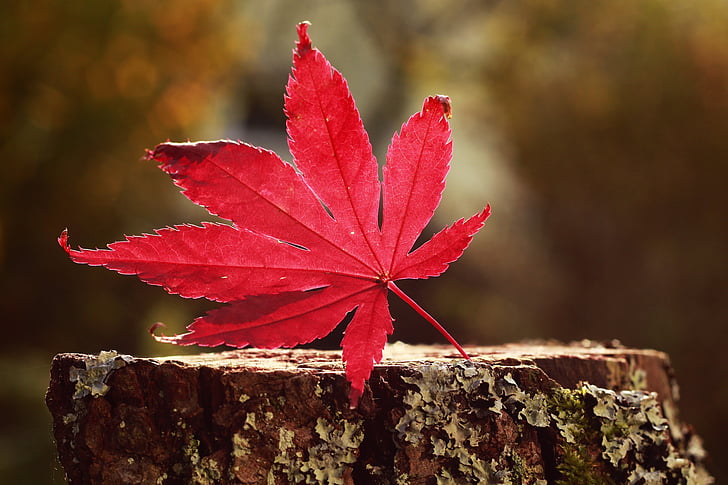
This screenshot has width=728, height=485. Identify the location of corners. (708, 478), (708, 11), (17, 18), (15, 463).